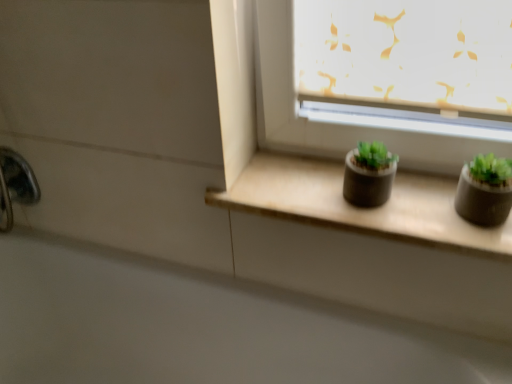
The height and width of the screenshot is (384, 512). Find the location of `vacant point to the right of matte black pot at center, the 1th flowerpot viewed from the left`. vacant point to the right of matte black pot at center, the 1th flowerpot viewed from the left is located at coordinates (426, 196).